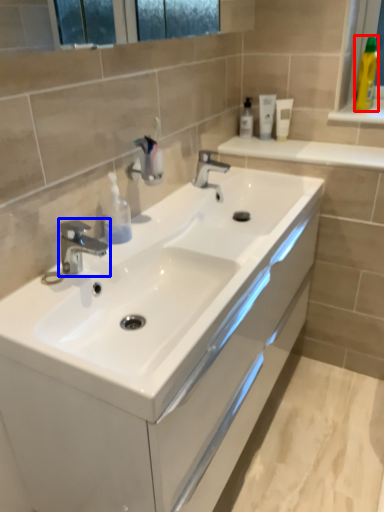
Question: Which object appears closest to the camera in this image, toiletry (highlighted by a red box) or tap (highlighted by a blue box)?

Choices:
 (A) toiletry
 (B) tap

Answer: (B)